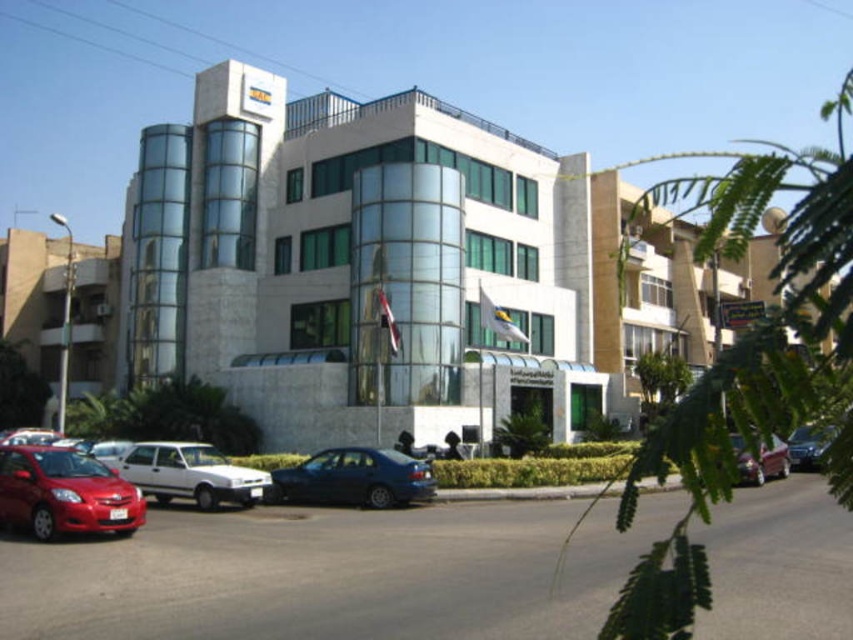
Does shiny red sedan at lower right come in front of metallic blue sedan at center?

Yes, it is.

The width and height of the screenshot is (853, 640). Describe the element at coordinates (759, 460) in the screenshot. I see `shiny red sedan at lower right` at that location.

What do you see at coordinates (759, 460) in the screenshot? I see `shiny red sedan at lower right` at bounding box center [759, 460].

The height and width of the screenshot is (640, 853). Identify the location of shiny red sedan at lower right. [x=759, y=460].

Is point (76, 470) positioned in front of point (787, 444)?

Yes, it is in front of point (787, 444).

Is shiny red sedan at lower left further to the viewer compared to metallic blue sedan at center?

Yes, it is.

Is point (86, 529) in front of point (819, 442)?

Yes, point (86, 529) is in front of point (819, 442).

Where is `shiny red sedan at lower left`? shiny red sedan at lower left is located at coordinates 64,492.

Based on the photo, can you confirm if shiny red sedan at lower left is positioned to the right of shiny red sedan at lower right?

In fact, shiny red sedan at lower left is to the left of shiny red sedan at lower right.

Between shiny red sedan at lower left and shiny red sedan at lower right, which one is positioned higher?

shiny red sedan at lower right is above.

Describe the element at coordinates (64, 492) in the screenshot. Image resolution: width=853 pixels, height=640 pixels. I see `shiny red sedan at lower left` at that location.

This screenshot has width=853, height=640. Find the location of `shiny red sedan at lower left`. shiny red sedan at lower left is located at coordinates (64, 492).